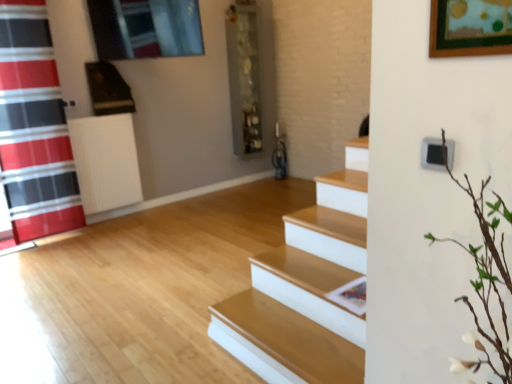
Locate an element on the screen. The height and width of the screenshot is (384, 512). red plaid shower curtain at left is located at coordinates (34, 127).

This screenshot has height=384, width=512. Describe the element at coordinates (244, 76) in the screenshot. I see `metallic gray shelf at center` at that location.

This screenshot has width=512, height=384. I want to click on white plastic radiator at left, so click(x=106, y=162).

Can you tell me how much metallic gray shelf at center and white plastic radiator at left differ in facing direction?

1.65 degrees.

Is metallic gray shelf at center further to the viewer compared to white plastic radiator at left?

Yes, metallic gray shelf at center is further from the viewer.

How distant is metallic gray shelf at center from white plastic radiator at left?

They are 1.57 meters apart.

Is metallic gray shelf at center taller or shorter than white plastic radiator at left?

metallic gray shelf at center is taller than white plastic radiator at left.

Based on the photo, is white plastic radiator at left looking in the opposite direction of metallic gray shelf at center?

No.

From the image's perspective, would you say white plastic radiator at left is positioned over metallic gray shelf at center?

No, from the image's perspective, white plastic radiator at left is not above metallic gray shelf at center.

Which is nearer, [85,123] or [231,101]?

Point [85,123].

I want to click on radiator in front of the metallic gray shelf at center, so click(106, 162).

Where is `shower curtain that is above the white plastic radiator at left (from the image's perspective)`? This screenshot has height=384, width=512. shower curtain that is above the white plastic radiator at left (from the image's perspective) is located at coordinates (34, 127).

How far apart are red plaid shower curtain at left and white plastic radiator at left?

A distance of 16.42 inches exists between red plaid shower curtain at left and white plastic radiator at left.

Considering the relative sizes of red plaid shower curtain at left and white plastic radiator at left in the image provided, is red plaid shower curtain at left shorter than white plastic radiator at left?

No, red plaid shower curtain at left is not shorter than white plastic radiator at left.

From the image's perspective, which is above, red plaid shower curtain at left or white plastic radiator at left?

red plaid shower curtain at left, from the image's perspective.

From the image's perspective, is metallic gray shelf at center over red plaid shower curtain at left?

Yes, from the image's perspective, metallic gray shelf at center is over red plaid shower curtain at left.

Could you tell me if metallic gray shelf at center is facing red plaid shower curtain at left?

No, metallic gray shelf at center is not turned towards red plaid shower curtain at left.

Is metallic gray shelf at center wider than red plaid shower curtain at left?

Correct, the width of metallic gray shelf at center exceeds that of red plaid shower curtain at left.

Which point is more distant from viewer, (234, 153) or (41, 102)?

The point (234, 153) is farther.

Is white plastic radiator at left outside of red plaid shower curtain at left?

Yes.

Measure the distance between white plastic radiator at left and red plaid shower curtain at left.

They are 16.42 inches apart.

Considering the positions of objects white plastic radiator at left and red plaid shower curtain at left in the image provided, who is more to the right, white plastic radiator at left or red plaid shower curtain at left?

white plastic radiator at left.

From a real-world perspective, which object stands above the other?

red plaid shower curtain at left.

Considering the positions of point (23, 230) and point (231, 57), is point (23, 230) closer or farther from the camera than point (231, 57)?

Clearly, point (23, 230) is closer to the camera than point (231, 57).

What's the angular difference between red plaid shower curtain at left and metallic gray shelf at center's facing directions?

They differ by 0.127 degrees in their facing directions.

Looking at this image, considering the relative positions of red plaid shower curtain at left and metallic gray shelf at center in the image provided, is red plaid shower curtain at left to the left of metallic gray shelf at center from the viewer's perspective?

Yes, red plaid shower curtain at left is to the left of metallic gray shelf at center.

Looking at this image, is red plaid shower curtain at left inside the boundaries of metallic gray shelf at center, or outside?

red plaid shower curtain at left lies outside metallic gray shelf at center.

Where is `radiator lying on the left of metallic gray shelf at center`? This screenshot has width=512, height=384. radiator lying on the left of metallic gray shelf at center is located at coordinates (106, 162).

Find the location of a particular element. Image resolution: width=512 pixels, height=384 pixels. shelf lying above the white plastic radiator at left (from the image's perspective) is located at coordinates (244, 76).

Estimate the real-world distances between objects in this image. Which object is closer to metallic gray shelf at center, red plaid shower curtain at left or white plastic radiator at left?

Based on the image, white plastic radiator at left appears to be nearer to metallic gray shelf at center.

When comparing their distances from white plastic radiator at left, does metallic gray shelf at center or red plaid shower curtain at left seem closer?

red plaid shower curtain at left lies closer to white plastic radiator at left than the other object.

Looking at the image, which one is located further to metallic gray shelf at center, white plastic radiator at left or red plaid shower curtain at left?

Based on the image, red plaid shower curtain at left appears to be further to metallic gray shelf at center.

From the image, which object appears to be farther from white plastic radiator at left, red plaid shower curtain at left or metallic gray shelf at center?

The object further to white plastic radiator at left is metallic gray shelf at center.

Looking at the image, which one is located closer to red plaid shower curtain at left, metallic gray shelf at center or white plastic radiator at left?

white plastic radiator at left.

Based on their spatial positions, is white plastic radiator at left or metallic gray shelf at center further from red plaid shower curtain at left?

The object further to red plaid shower curtain at left is metallic gray shelf at center.

Identify the location of radiator situated between red plaid shower curtain at left and metallic gray shelf at center from left to right. (106, 162).